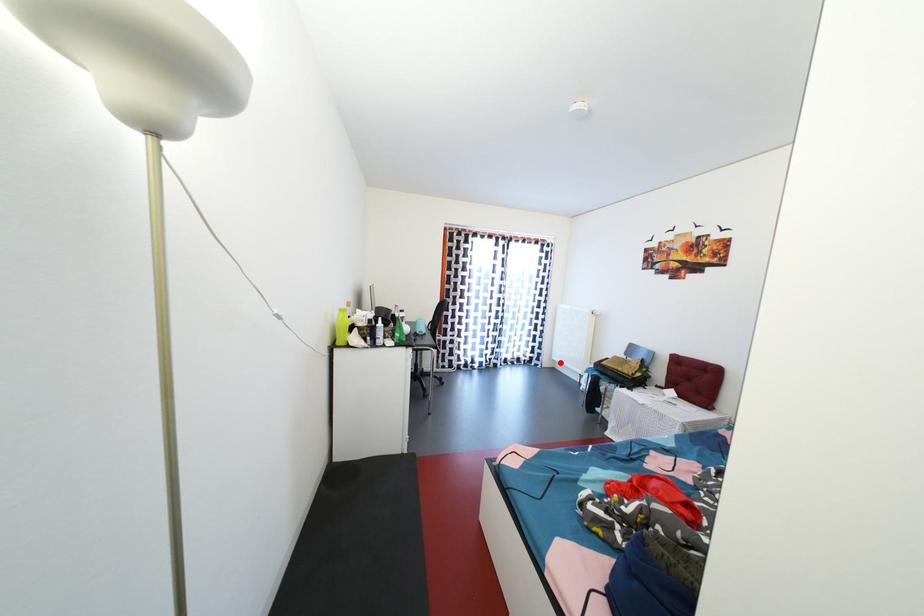
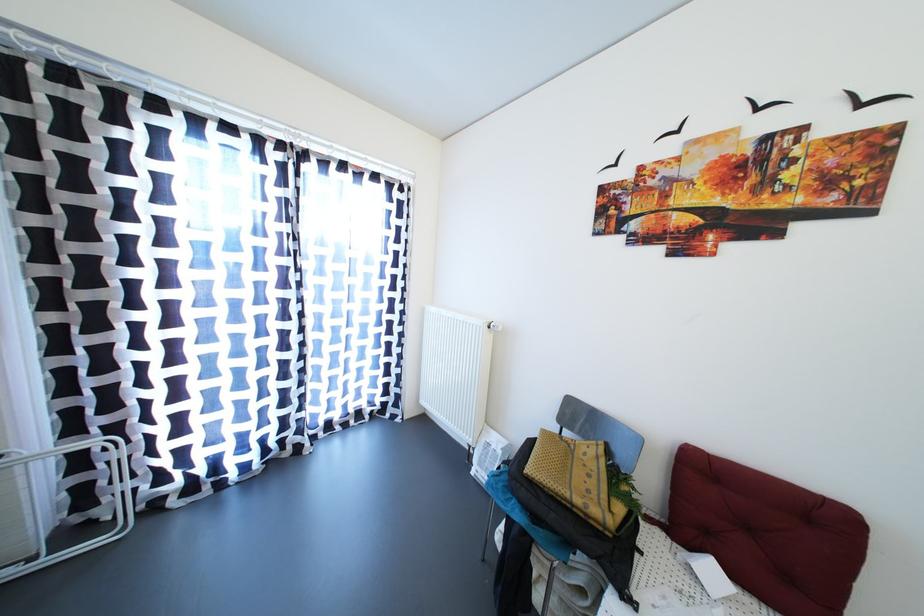
Question: I am providing you with two images of the same scene from different viewpoints. Given a red point in image1, look at the same physical point in image2. Is it:

Choices:
 (A) Closer to the viewpoint
 (B) Farther from the viewpoint

Answer: (B)